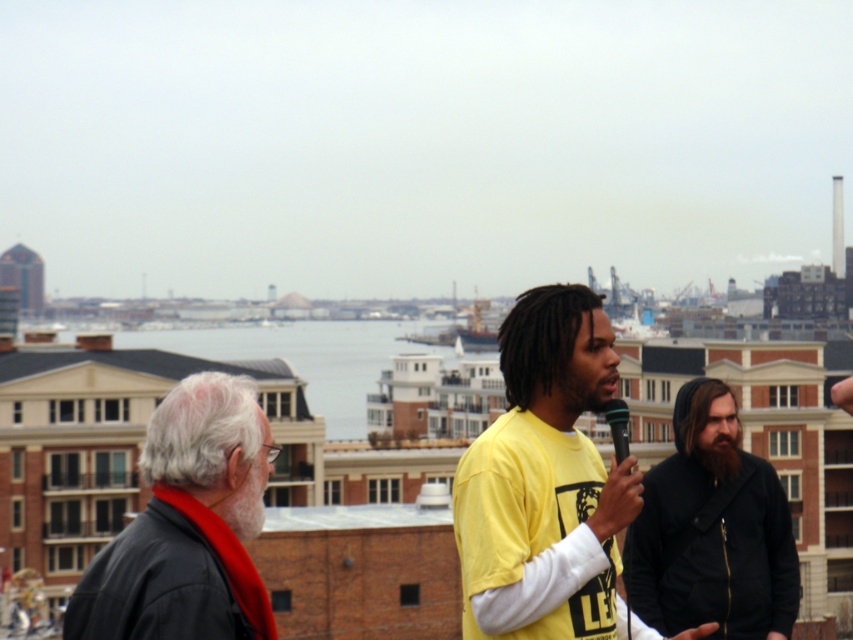
You are a photographer trying to capture a group photo of the yellow matte shirt at center and the black hoodie at center. If you want to ensure both are in focus, which one should you adjust the camera focus to prioritize based on their sizes?

The yellow matte shirt at center has a larger width than the black hoodie at center, so you should prioritize focusing on the yellow matte shirt at center since it occupies more space in the frame.

You are a photographer positioned at the back of the rooftop. You want to take a photo of the yellow matte shirt at center and the black matte microphone at center such that both are clearly visible. Given that your camera has a minimum focus distance of 3 meters, will you be able to capture both objects in focus without moving closer?

The yellow matte shirt at center and black matte microphone at center are 2.83 meters apart. Since the distance between them is less than the camera minimum focus distance of 3 meters, you can capture both objects in focus without moving closer.

You are a photographer trying to capture a clear photo of the black matte microphone at center during the rooftop discussion. Considering the black hoodie at center is larger, could the microphone be partially obscured by the hoodie?

The black hoodie at center has a larger size compared to the black matte microphone at center, so there is a possibility that the microphone could be partially obscured by the hoodie.